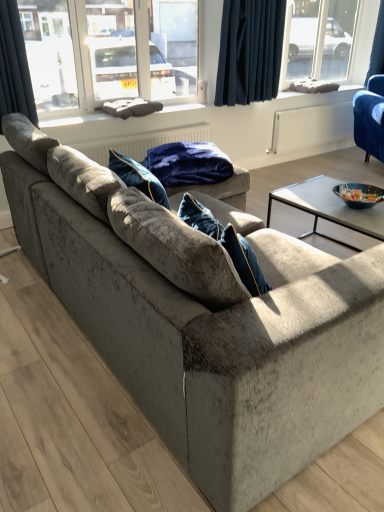
At what (x,y) coordinates should I click in order to perform the action: click on vacant space positioned to the left of velvet blue armchair at upper right. Please return your answer as a coordinate pair (x, y). The image size is (384, 512). Looking at the image, I should click on (329, 162).